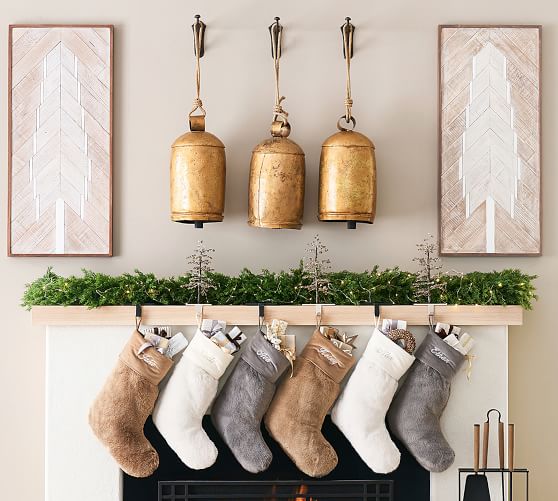
The height and width of the screenshot is (501, 558). I want to click on painting, so click(x=70, y=139), click(x=472, y=140).